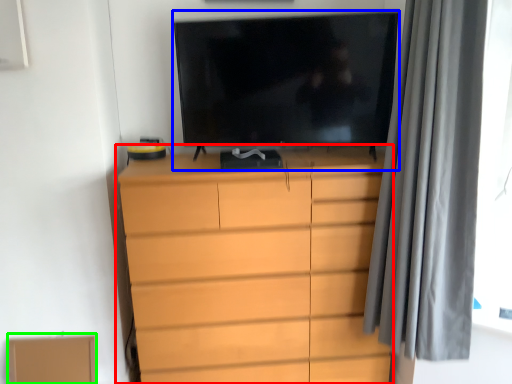
Question: Which is nearer to the chest of drawers (highlighted by a red box)? television (highlighted by a blue box) or cardboard box (highlighted by a green box).

Choices:
 (A) television
 (B) cardboard box

Answer: (A)